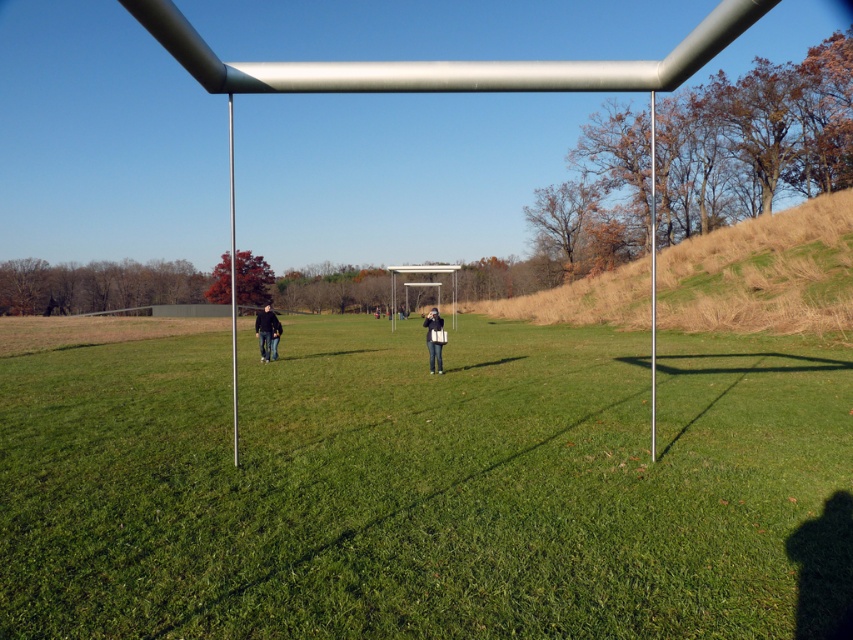
Who is lower down, green grassy field at center or dark blue jeans at left?

green grassy field at center is below.

Does green grassy field at center come in front of dark blue jeans at left?

Yes, green grassy field at center is closer to the viewer.

Who is more forward, (467,620) or (257,321)?

Positioned in front is point (467,620).

Locate an element on the screen. Image resolution: width=853 pixels, height=640 pixels. green grassy field at center is located at coordinates (427, 486).

Does green grassy field at center have a larger size compared to denim jeans at center?

Yes, green grassy field at center is bigger than denim jeans at center.

Between point (229, 396) and point (434, 364), which one is positioned in front?

Point (229, 396)

Identify the location of green grassy field at center. (427, 486).

Between dark blue jeans at left and denim jeans at center, which one is positioned higher?

dark blue jeans at left is above.

Is point (270, 323) in front of point (434, 314)?

No.

Is point (263, 332) farther from viewer compared to point (430, 364)?

That is True.

Identify the location of dark blue jeans at left. (265, 332).